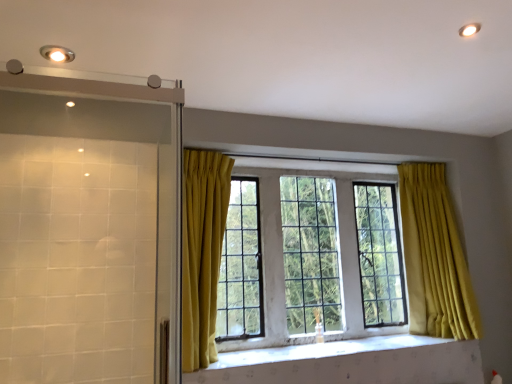
Describe the element at coordinates (434, 256) in the screenshot. This screenshot has width=512, height=384. I see `clear glass window at center` at that location.

Measure the distance between point (468, 30) and camera.

The depth of point (468, 30) is 5.63 feet.

Identify the location of white textured stone at center. (322, 350).

Measure the distance between matte silver light fixture at upper left and camera.

A distance of 5.81 feet exists between matte silver light fixture at upper left and camera.

In order to face matte silver light fixture at upper left, should I rotate leftwards or rightwards?

Rotate left and turn 25.016 degrees.

Image resolution: width=512 pixels, height=384 pixels. I want to click on clear glass window at center, so click(434, 256).

From a real-world perspective, is clear glass window at center located higher than white glossy light fixture at upper right?

Actually, clear glass window at center is physically below white glossy light fixture at upper right in the real world.

Which is behind, point (423, 273) or point (476, 26)?

The point (423, 273) is farther.

In order to click on lighting that is on the right side of clear glass window at center in this screenshot , I will do `click(469, 29)`.

In the scene shown: Considering the positions of objects clear glass window at center and white glossy light fixture at upper right in the image provided, who is more to the right, clear glass window at center or white glossy light fixture at upper right?

white glossy light fixture at upper right.

Are white textured stone at center and white glossy light fixture at upper right far apart?

Yes, white textured stone at center and white glossy light fixture at upper right are located far from each other.

Based on the photo, is white textured stone at center looking in the opposite direction of white glossy light fixture at upper right?

No, white textured stone at center's orientation is not away from white glossy light fixture at upper right.

Between white textured stone at center and white glossy light fixture at upper right, which one appears on the right side from the viewer's perspective?

From the viewer's perspective, white glossy light fixture at upper right appears more on the right side.

Is white textured stone at center situated inside white glossy light fixture at upper right or outside?

white textured stone at center is outside white glossy light fixture at upper right.

Is white glossy light fixture at upper right aimed at matte silver light fixture at upper left?

Yes, white glossy light fixture at upper right is turned towards matte silver light fixture at upper left.

Could matte silver light fixture at upper left be considered to be inside white glossy light fixture at upper right?

Actually, matte silver light fixture at upper left is outside white glossy light fixture at upper right.

Is white glossy light fixture at upper right wider than matte silver light fixture at upper left?

No, white glossy light fixture at upper right is not wider than matte silver light fixture at upper left.

You are a GUI agent. You are given a task and a screenshot of the screen. Output one action in this format:
    pyautogui.click(x=<x>, y=<y>)
    Task: Click on the light fixture that is on the left side of white glossy light fixture at upper right
    This screenshot has width=512, height=384.
    Given the screenshot: What is the action you would take?
    pyautogui.click(x=57, y=53)

Is clear glass shower door at left beside white glossy light fixture at upper right?

No, clear glass shower door at left is not making contact with white glossy light fixture at upper right.

Considering the relative positions of clear glass shower door at left and white glossy light fixture at upper right in the image provided, is clear glass shower door at left to the left of white glossy light fixture at upper right from the viewer's perspective?

Yes.

From the image's perspective, is clear glass shower door at left located above or below white glossy light fixture at upper right?

Based on their image positions, clear glass shower door at left is located beneath white glossy light fixture at upper right.

Between matte silver light fixture at upper left and white glossy light fixture at upper right, which one is positioned in front?

white glossy light fixture at upper right is in front.

From a real-world perspective, is matte silver light fixture at upper left positioned above or below white glossy light fixture at upper right?

Clearly, from a real-world perspective, matte silver light fixture at upper left is above white glossy light fixture at upper right.

Between matte silver light fixture at upper left and white glossy light fixture at upper right, which one has smaller size?

With smaller size is white glossy light fixture at upper right.

Which object is positioned more to the right, white glossy light fixture at upper right or white textured stone at center?

From the viewer's perspective, white glossy light fixture at upper right appears more on the right side.

From a real-world perspective, is white glossy light fixture at upper right located beneath white textured stone at center?

No, from a real-world perspective, white glossy light fixture at upper right is not below white textured stone at center.

Based on the photo, is the position of white glossy light fixture at upper right less distant than that of white textured stone at center?

That is True.

Is point (469, 34) positioned in front of point (365, 346)?

Yes, point (469, 34) is in front of point (365, 346).

Is white glossy light fixture at upper right looking in the opposite direction of clear glass window at center?

No, white glossy light fixture at upper right's orientation is not away from clear glass window at center.

Is white glossy light fixture at upper right outside of clear glass window at center?

white glossy light fixture at upper right lies outside clear glass window at center's area.

This screenshot has width=512, height=384. Find the location of `window located behind the white glossy light fixture at upper right`. window located behind the white glossy light fixture at upper right is located at coordinates tap(434, 256).

Relative to clear glass window at center, is white glossy light fixture at upper right in front or behind?

white glossy light fixture at upper right is positioned closer to the viewer than clear glass window at center.

What are the coordinates of `lighting on the right of clear glass window at center` in the screenshot? It's located at (469, 29).

The height and width of the screenshot is (384, 512). I want to click on window sill that appears below the white glossy light fixture at upper right (from the image's perspective), so click(322, 350).

Looking at this image, based on their spatial positions, is matte silver light fixture at upper left or clear glass shower door at left further from white glossy light fixture at upper right?

clear glass shower door at left is further to white glossy light fixture at upper right.

Estimate the real-world distances between objects in this image. Which object is further from matte silver light fixture at upper left, white glossy light fixture at upper right or clear glass shower door at left?

white glossy light fixture at upper right lies further to matte silver light fixture at upper left than the other object.

From the picture: Based on their spatial positions, is clear glass shower door at left or white glossy light fixture at upper right closer to white textured stone at center?

clear glass shower door at left is closer to white textured stone at center.

From the image, which object appears to be farther from clear glass window at center, white textured stone at center or white glossy light fixture at upper right?

white glossy light fixture at upper right is positioned further to the anchor clear glass window at center.

When comparing their distances from matte silver light fixture at upper left, does clear glass shower door at left or white glossy light fixture at upper right seem closer?

clear glass shower door at left.

Which object lies further to the anchor point white glossy light fixture at upper right, white textured stone at center or clear glass window at center?

white textured stone at center is positioned further to the anchor white glossy light fixture at upper right.

Which object lies further to the anchor point white textured stone at center, clear glass window at center or matte silver light fixture at upper left?

matte silver light fixture at upper left is further to white textured stone at center.

From the image, which object appears to be nearer to matte silver light fixture at upper left, white textured stone at center or clear glass shower door at left?

clear glass shower door at left is positioned closer to the anchor matte silver light fixture at upper left.

At what (x,y) coordinates should I click in order to perform the action: click on window between matte silver light fixture at upper left and white textured stone at center in the up-down direction. Please return your answer as a coordinate pair (x, y). Looking at the image, I should click on (434, 256).

Locate an element on the screen. This screenshot has height=384, width=512. screen door that lies between matte silver light fixture at upper left and white textured stone at center from top to bottom is located at coordinates point(88,230).

Locate an element on the screen. light fixture positioned between clear glass shower door at left and clear glass window at center from near to far is located at coordinates (57, 53).

In order to click on window between clear glass shower door at left and white glossy light fixture at upper right from left to right in this screenshot , I will do `click(434, 256)`.